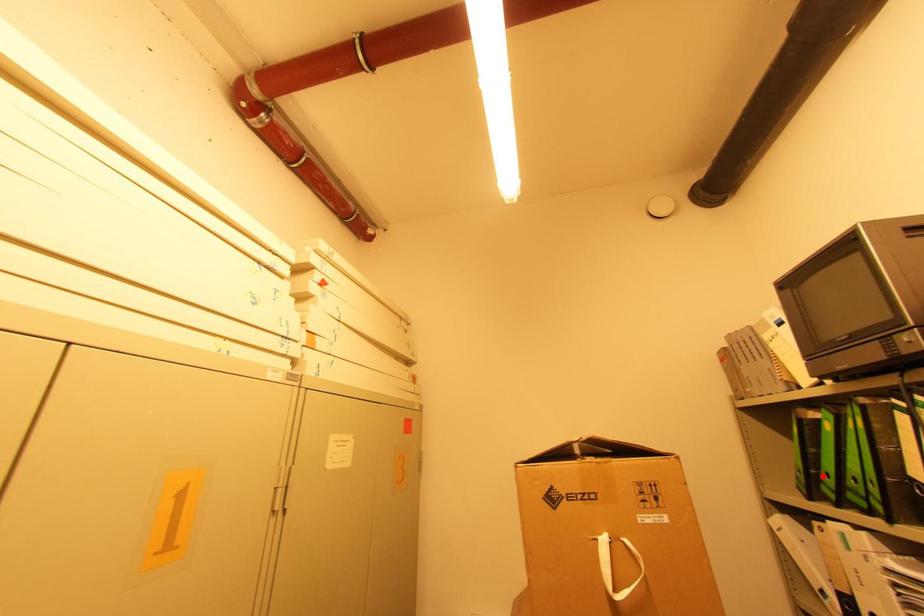
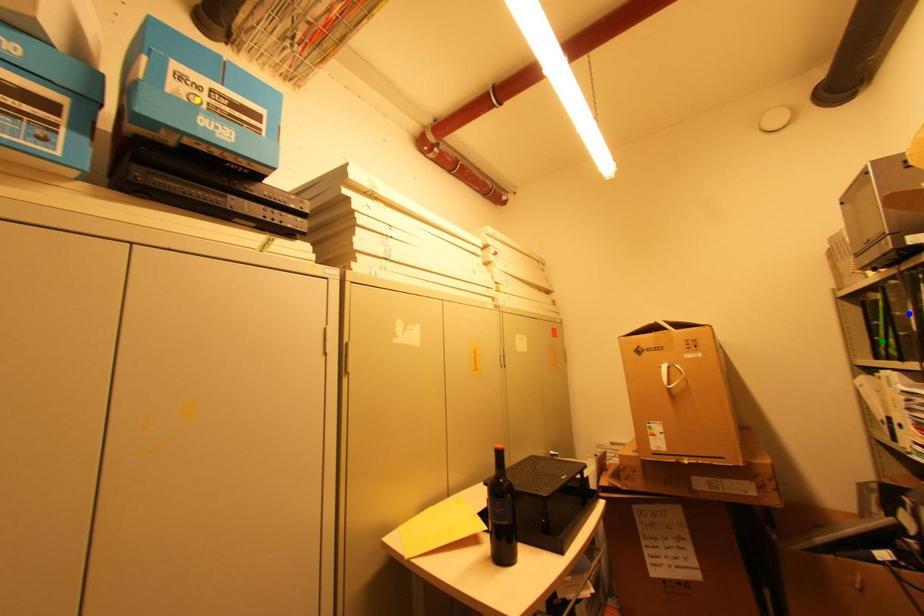
Question: I am providing you with two images of the same scene from different viewpoints. A red point is marked on the first image. You are given multiple points on the second image. Can you choose the point in image 2 that corresponds to the point in image 1?

Choices:
 (A) yellow point
 (B) green point
 (C) blue point

Answer: (B)